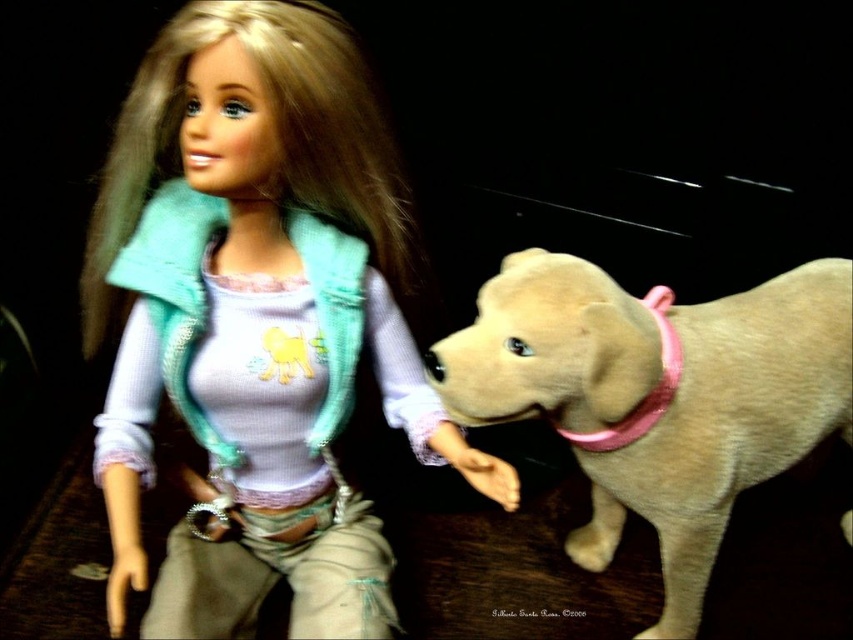
You are a toy collector examining the image of two dolls. You notice the matte teal vest at upper left and the light beige plush dog at center. Which object is positioned higher in the image?

The matte teal vest at upper left is located above the light beige plush dog at center, so it is positioned higher in the image.

You are a photographer setting up a shoot with the matte teal vest at upper left and the light beige plush dog at center. You want to adjust the lighting so that the object closer to the camera is better illuminated. Which object should you focus the light on?

The matte teal vest at upper left is closer to the viewer, so you should focus the light on the matte teal vest at upper left to ensure it is better illuminated.

You are trying to decide which item to place in a narrow display case. The case can only accommodate items that are not too thick. Which object from the scene, the matte teal vest at upper left or the light beige plush dog at center, would you choose for the display case?

The matte teal vest at upper left is thinner than the light beige plush dog at center, so it would fit better in the narrow display case.